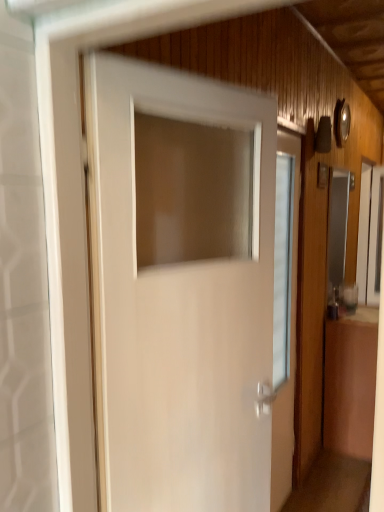
Question: Does clear glass window at right have a lesser width compared to white glossy door at center?

Choices:
 (A) no
 (B) yes

Answer: (B)

Question: Is clear glass window at right not within white glossy door at center?

Choices:
 (A) no
 (B) yes

Answer: (B)

Question: Is clear glass window at right oriented away from white glossy door at center?

Choices:
 (A) no
 (B) yes

Answer: (A)

Question: Considering the relative positions of clear glass window at right and white glossy door at center in the image provided, is clear glass window at right behind white glossy door at center?

Choices:
 (A) yes
 (B) no

Answer: (A)

Question: From a real-world perspective, is clear glass window at right over white glossy door at center?

Choices:
 (A) no
 (B) yes

Answer: (B)

Question: From a real-world perspective, is clear glass window at right positioned under white glossy door at center based on gravity?

Choices:
 (A) yes
 (B) no

Answer: (B)

Question: Could you tell me if white glossy door at center is facing clear glass window at right?

Choices:
 (A) yes
 (B) no

Answer: (B)

Question: Is clear glass window at right at the back of white glossy door at center?

Choices:
 (A) yes
 (B) no

Answer: (B)

Question: Does white glossy door at center come in front of clear glass window at right?

Choices:
 (A) no
 (B) yes

Answer: (B)

Question: Is white glossy door at center surrounding clear glass window at right?

Choices:
 (A) yes
 (B) no

Answer: (B)

Question: From the image's perspective, is white glossy door at center beneath clear glass window at right?

Choices:
 (A) no
 (B) yes

Answer: (B)

Question: Can you confirm if white glossy door at center is bigger than clear glass window at right?

Choices:
 (A) yes
 (B) no

Answer: (B)

Question: From a real-world perspective, relative to clear glass window at right, is white glossy door at center vertically above or below?

Choices:
 (A) below
 (B) above

Answer: (A)